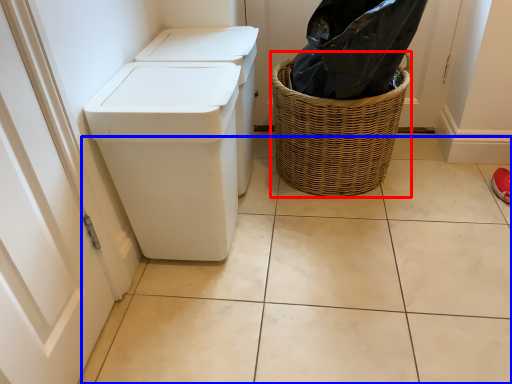
Question: Which of the following is the closest to the observer, basket (highlighted by a red box) or tile (highlighted by a blue box)?

Choices:
 (A) basket
 (B) tile

Answer: (B)